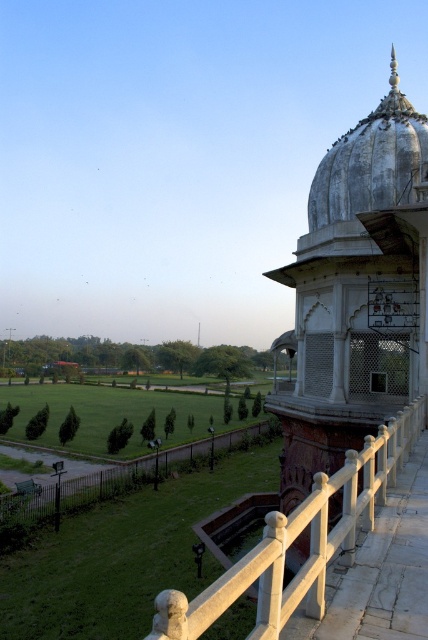
You are standing at the entrance of the historical building and want to walk towards the white stone railing at lower right. Which direction should you move relative to the white stone railing at lower center?

You should move to the right of the white stone railing at lower center to reach the white stone railing at lower right.